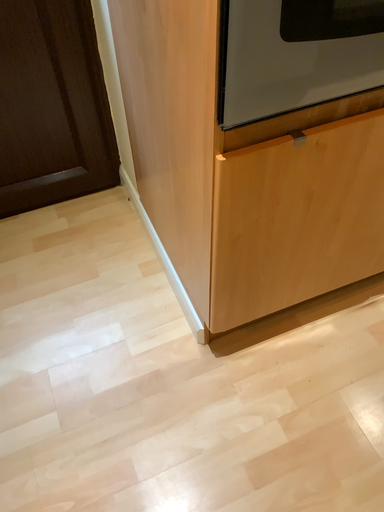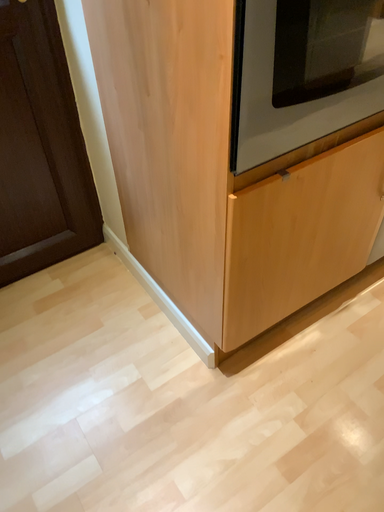
Question: Which way did the camera rotate in the video?

Choices:
 (A) rotated left
 (B) rotated right

Answer: (B)